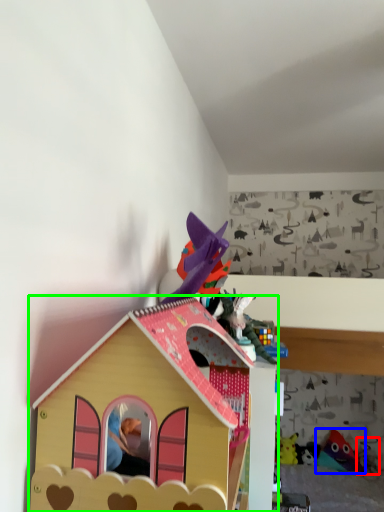
Question: Based on their relative distances, which object is nearer to toy (highlighted by a red box)? Choose from toy (highlighted by a blue box) and toy (highlighted by a green box).

Choices:
 (A) toy
 (B) toy

Answer: (A)